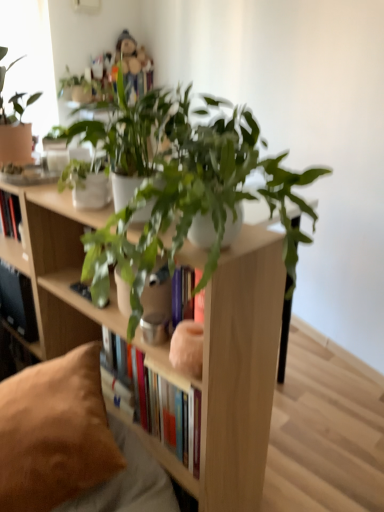
Question: In terms of height, does black matte shelf at lower left look taller or shorter compared to matte glass window screen at upper left?

Choices:
 (A) short
 (B) tall

Answer: (A)

Question: From a real-world perspective, is black matte shelf at lower left above or below matte glass window screen at upper left?

Choices:
 (A) above
 (B) below

Answer: (B)

Question: Which object is the closest to the green matte plant at center, the second houseplant from the front?

Choices:
 (A) matte white bookcase at center
 (B) matte glass window screen at upper left
 (C) green matte plant at upper center, the 1th houseplant when ordered from front to back
 (D) brown suede pillow at lower left
 (E) black matte shelf at lower left

Answer: (C)

Question: Estimate the real-world distances between objects in this image. Which object is farther from the green matte plant at upper center, marked as the second houseplant in a back-to-front arrangement?

Choices:
 (A) matte glass window screen at upper left
 (B) black matte shelf at lower left
 (C) matte white bookcase at center
 (D) brown suede pillow at lower left
 (E) green matte plant at center, which is counted as the 1th houseplant, starting from the back

Answer: (A)